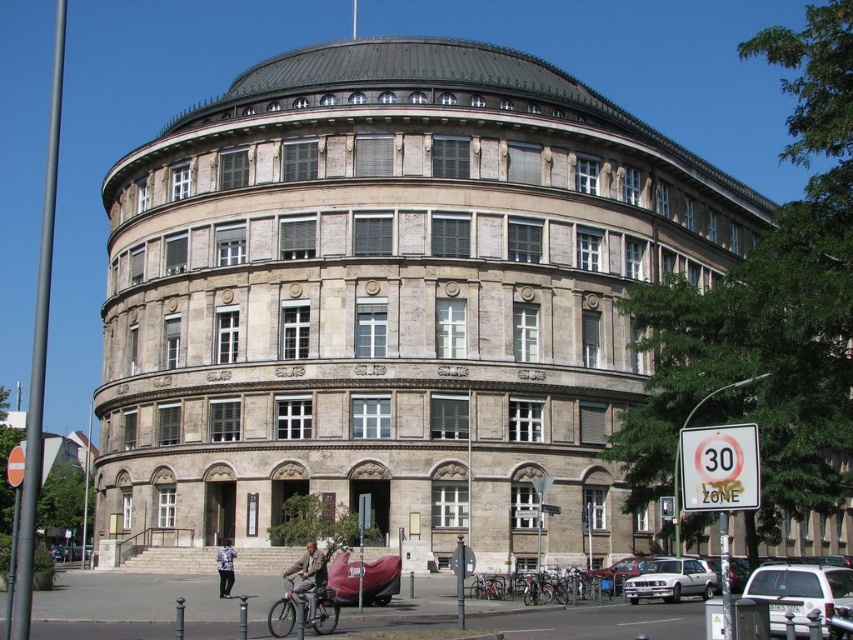
Question: Which object is the farthest from the matte red car at center?

Choices:
 (A) silver metallic hatchback at lower right
 (B) white plastic car at lower right
 (C) metallic silver bicycle at lower center

Answer: (B)

Question: Among these points, which one is nearest to the camera?

Choices:
 (A) (223, 596)
 (B) (674, 579)

Answer: (A)

Question: Among these objects, which one is farthest from the camera?

Choices:
 (A) silver metallic hatchback at lower right
 (B) white plastic car at lower right

Answer: (A)

Question: Considering the relative positions of pink matte bicycle at lower center and matte red car at center in the image provided, where is pink matte bicycle at lower center located with respect to matte red car at center?

Choices:
 (A) right
 (B) left

Answer: (B)

Question: Is silver metallic hatchback at lower right closer to camera compared to metallic silver bicycle at lower center?

Choices:
 (A) no
 (B) yes

Answer: (B)

Question: Does white plastic car at lower right appear on the left side of matte red car at center?

Choices:
 (A) no
 (B) yes

Answer: (A)